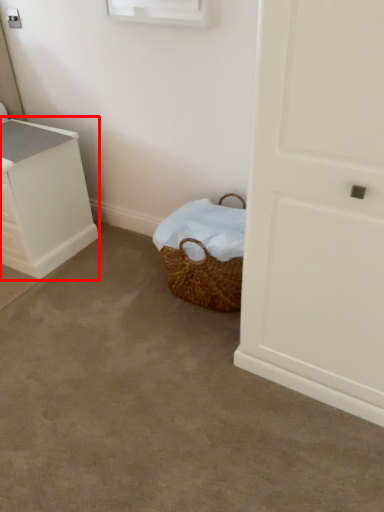
Question: In this image, where is chest of drawers (annotated by the red box) located relative to concrete?

Choices:
 (A) right
 (B) left

Answer: (B)